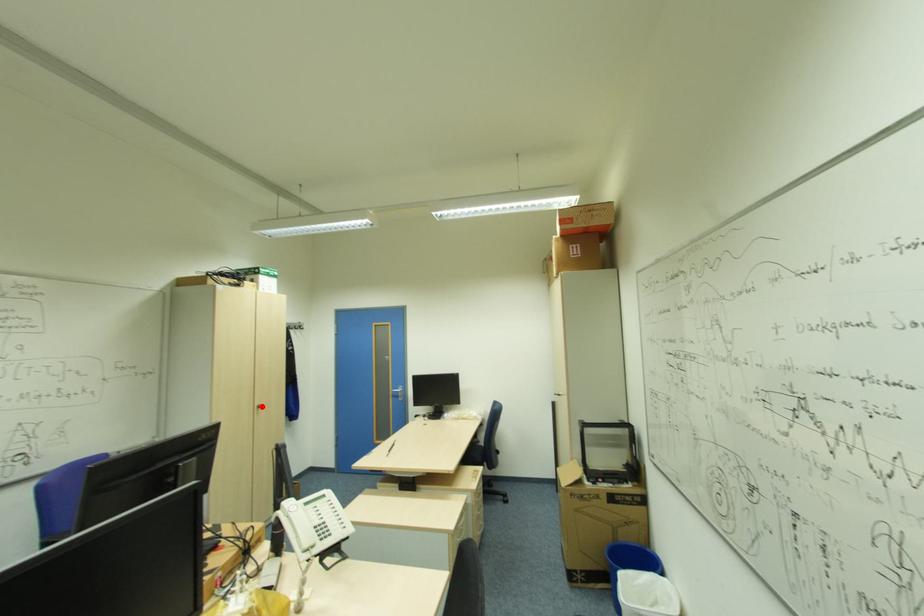
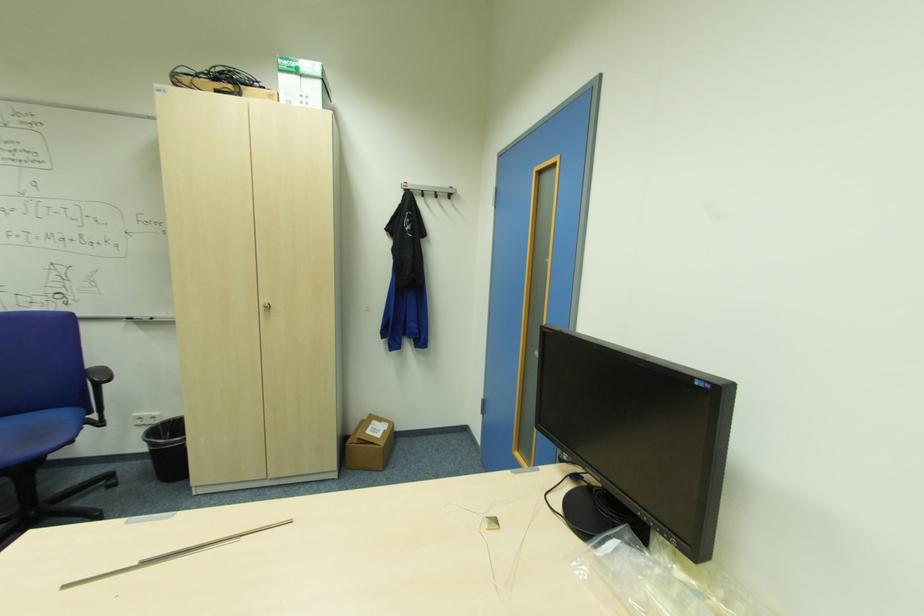
The point at the highlighted location is marked in the first image. Where is the corresponding point in the second image?

(271, 307)